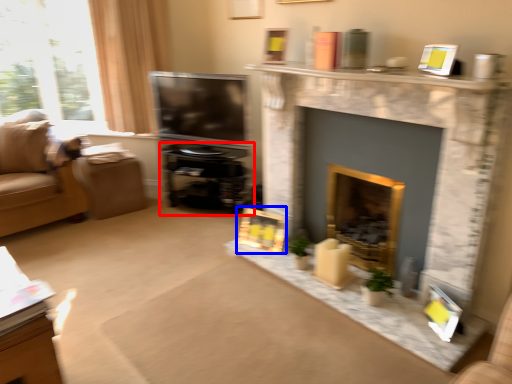
Question: Which of the following is the closest to the observer, entertainment center (highlighted by a red box) or picture frame (highlighted by a blue box)?

Choices:
 (A) entertainment center
 (B) picture frame

Answer: (B)